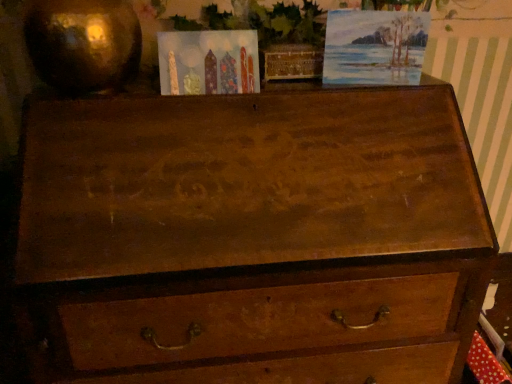
Question: Could watercolor paper painting at upper right be considered to be inside matte paper postcard at upper center?

Choices:
 (A) no
 (B) yes

Answer: (A)

Question: Is matte paper postcard at upper center bigger than watercolor paper painting at upper right?

Choices:
 (A) yes
 (B) no

Answer: (B)

Question: Does matte paper postcard at upper center have a greater height compared to watercolor paper painting at upper right?

Choices:
 (A) yes
 (B) no

Answer: (B)

Question: From the image's perspective, is matte paper postcard at upper center above watercolor paper painting at upper right?

Choices:
 (A) no
 (B) yes

Answer: (A)

Question: Considering the relative positions of matte paper postcard at upper center and watercolor paper painting at upper right in the image provided, is matte paper postcard at upper center in front of watercolor paper painting at upper right?

Choices:
 (A) no
 (B) yes

Answer: (B)

Question: Does matte paper postcard at upper center have a lesser height compared to watercolor paper painting at upper right?

Choices:
 (A) yes
 (B) no

Answer: (A)

Question: Is watercolor paper painting at upper right positioned beyond the bounds of matte paper postcard at upper center?

Choices:
 (A) yes
 (B) no

Answer: (A)

Question: Can you confirm if watercolor paper painting at upper right is shorter than matte paper postcard at upper center?

Choices:
 (A) no
 (B) yes

Answer: (A)

Question: Is watercolor paper painting at upper right oriented away from matte paper postcard at upper center?

Choices:
 (A) yes
 (B) no

Answer: (B)

Question: Is the depth of watercolor paper painting at upper right greater than that of matte paper postcard at upper center?

Choices:
 (A) yes
 (B) no

Answer: (A)

Question: Considering the relative sizes of watercolor paper painting at upper right and matte paper postcard at upper center in the image provided, is watercolor paper painting at upper right thinner than matte paper postcard at upper center?

Choices:
 (A) no
 (B) yes

Answer: (B)

Question: From a real-world perspective, does watercolor paper painting at upper right stand above matte paper postcard at upper center?

Choices:
 (A) no
 (B) yes

Answer: (B)

Question: From a real-world perspective, is watercolor paper painting at upper right positioned above or below matte paper postcard at upper center?

Choices:
 (A) below
 (B) above

Answer: (B)